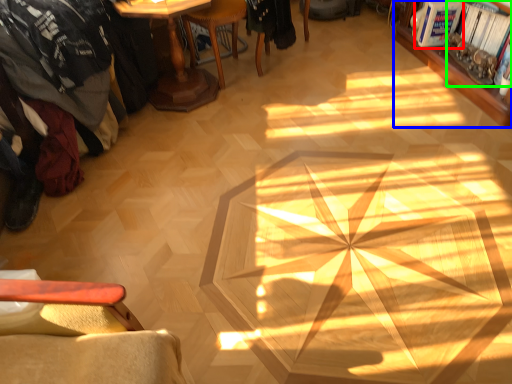
Question: Which object is the closest to the magazine (highlighted by a red box)? Choose among these: bookcase (highlighted by a blue box) or magazine (highlighted by a green box).

Choices:
 (A) bookcase
 (B) magazine

Answer: (B)